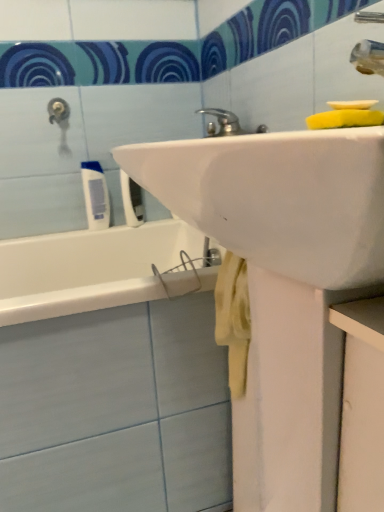
Question: Considering the relative positions of white plastic toothbrush at upper left, which is the 1th toiletry in right-to-left order, and yellow sponge at upper right in the image provided, is white plastic toothbrush at upper left, which is the 1th toiletry in right-to-left order, to the left of yellow sponge at upper right from the viewer's perspective?

Choices:
 (A) yes
 (B) no

Answer: (A)

Question: Could you tell me if white plastic toothbrush at upper left, the 2th toiletry in the left-to-right sequence, is turned towards yellow sponge at upper right?

Choices:
 (A) no
 (B) yes

Answer: (A)

Question: From the image's perspective, does white plastic toothbrush at upper left, the 2th toiletry in the left-to-right sequence, appear higher than yellow sponge at upper right?

Choices:
 (A) yes
 (B) no

Answer: (B)

Question: From a real-world perspective, is white plastic toothbrush at upper left, the 2th toiletry in the left-to-right sequence, below yellow sponge at upper right?

Choices:
 (A) yes
 (B) no

Answer: (A)

Question: Is the position of white plastic toothbrush at upper left, which is the 1th toiletry in right-to-left order, more distant than that of yellow sponge at upper right?

Choices:
 (A) yes
 (B) no

Answer: (A)

Question: From a real-world perspective, relative to yellow sponge at upper right, is white plastic toothbrush at upper left, which is the 1th toiletry in right-to-left order, vertically above or below?

Choices:
 (A) below
 (B) above

Answer: (A)

Question: Does point 125,215 appear closer or farther from the camera than point 359,120?

Choices:
 (A) farther
 (B) closer

Answer: (A)

Question: Looking at their shapes, would you say white plastic toothbrush at upper left, the 2th toiletry in the left-to-right sequence, is wider or thinner than yellow sponge at upper right?

Choices:
 (A) wide
 (B) thin

Answer: (B)

Question: Is white plastic toothbrush at upper left, the 2th toiletry in the left-to-right sequence, in front of or behind yellow sponge at upper right in the image?

Choices:
 (A) behind
 (B) front

Answer: (A)

Question: Is yellow sponge at upper right inside or outside of white plastic toothbrush at upper left, which is the 1th toiletry in right-to-left order?

Choices:
 (A) inside
 (B) outside

Answer: (B)

Question: From the image's perspective, relative to white plastic toothbrush at upper left, which is the 1th toiletry in right-to-left order, is yellow sponge at upper right above or below?

Choices:
 (A) below
 (B) above

Answer: (B)

Question: Does point (380, 117) appear closer or farther from the camera than point (142, 217)?

Choices:
 (A) closer
 (B) farther

Answer: (A)

Question: Considering their positions, is yellow sponge at upper right located in front of or behind white plastic toothbrush at upper left, which is the 1th toiletry in right-to-left order?

Choices:
 (A) front
 (B) behind

Answer: (A)

Question: From the image's perspective, relative to yellow sponge at upper right, is white matte tube at left, positioned as the first toiletry in left-to-right order, above or below?

Choices:
 (A) above
 (B) below

Answer: (B)

Question: Does point (86, 200) appear closer or farther from the camera than point (374, 115)?

Choices:
 (A) farther
 (B) closer

Answer: (A)